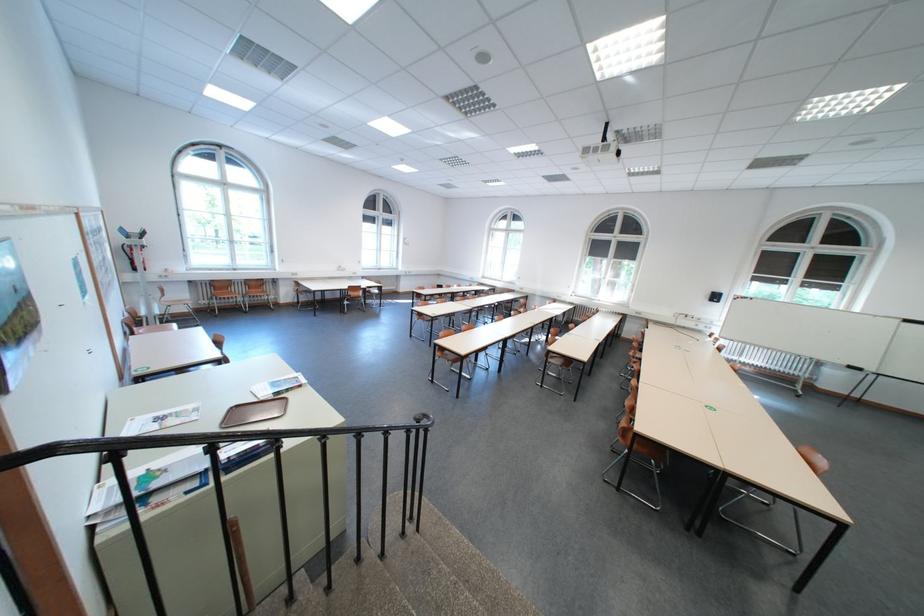
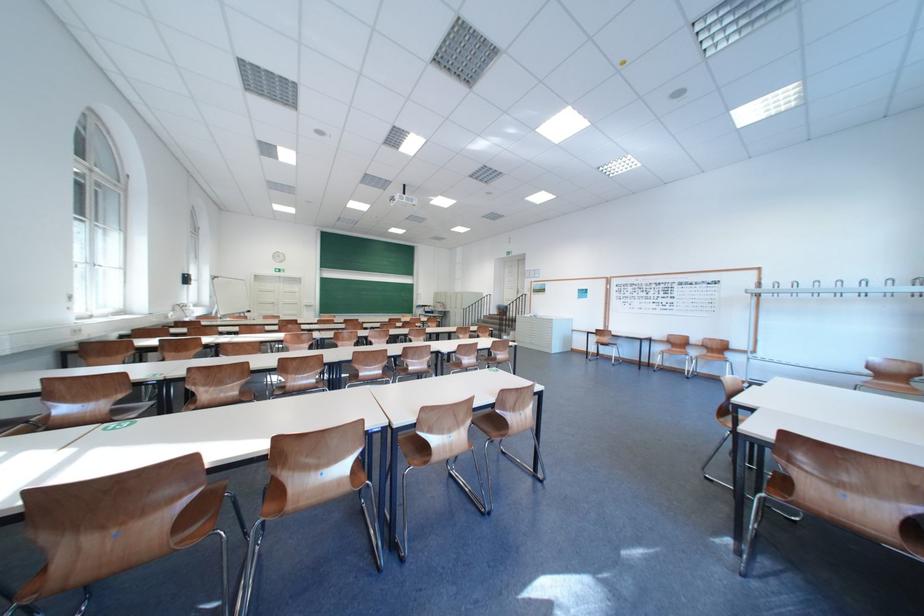
Question: I am providing you with two images of the same scene from different viewpoints. After the viewpoint changes to image2, which objects are now occluded?

Choices:
 (A) cabinet drawer handle
 (B) white door handle
 (C) black stair railing
 (D) oven control knob

Answer: (C)